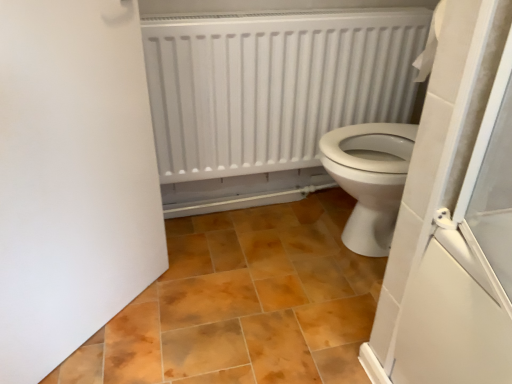
Where is `free space underneath white matte door at left (from a real-world perspective)`? Image resolution: width=512 pixels, height=384 pixels. free space underneath white matte door at left (from a real-world perspective) is located at coordinates (106, 325).